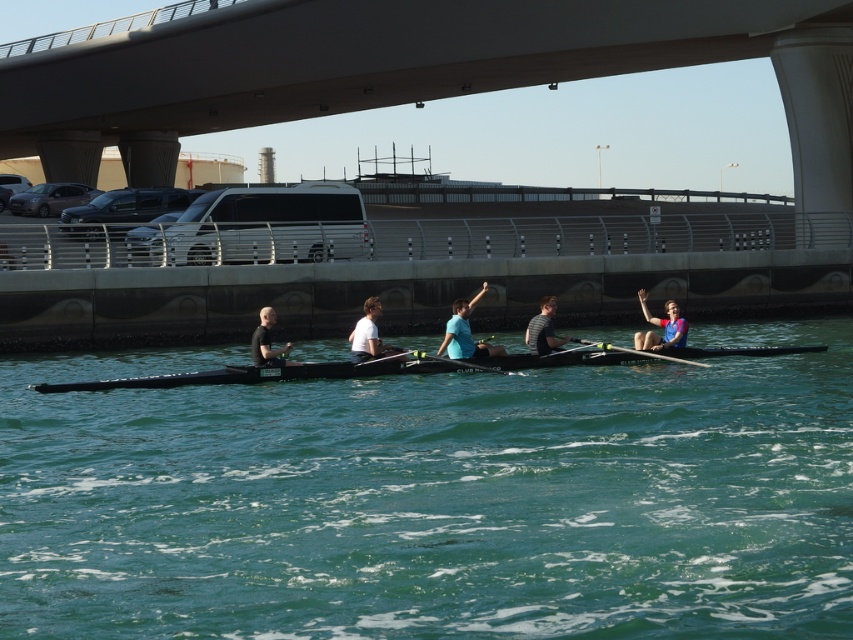
Looking at this image, measure the distance between point (699, 573) and camera.

Point (699, 573) and camera are 30.86 feet apart.

Does green water at center have a greater height compared to white matte shirt at center?

Indeed, green water at center has a greater height compared to white matte shirt at center.

You are a GUI agent. You are given a task and a screenshot of the screen. Output one action in this format:
    pyautogui.click(x=<x>, y=<y>)
    Task: Click on the green water at center
    This screenshot has height=640, width=853.
    Given the screenshot: What is the action you would take?
    pyautogui.click(x=434, y=499)

Does blue fabric rower at right appear on the left side of rubber paddle at center?

No, blue fabric rower at right is not to the left of rubber paddle at center.

Is blue fabric rower at right positioned behind rubber paddle at center?

Yes, it is.

Where is `blue fabric rower at right`? Image resolution: width=853 pixels, height=640 pixels. blue fabric rower at right is located at coordinates (660, 326).

Can you confirm if matte blue shirt at center is smaller than blue fabric rower at right?

No, matte blue shirt at center is not smaller than blue fabric rower at right.

Is matte blue shirt at center behind blue fabric rower at right?

Result: No, it is not.

Is point (451, 339) positioned behind point (674, 330)?

No.

At what (x,y) coordinates should I click in order to perform the action: click on matte blue shirt at center. Please return your answer as a coordinate pair (x, y). This screenshot has width=853, height=640. Looking at the image, I should click on (465, 332).